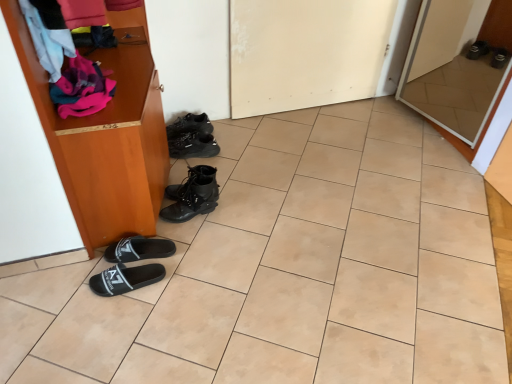
At what (x,y) coordinates should I click in order to perform the action: click on vacant area that lies between black fabric slipper at lower left, which ranks as the fourth footwear in back-to-front order, and black leather boots at center, which appears as the 3th footwear when viewed from the back. Please return your answer as a coordinate pair (x, y). The height and width of the screenshot is (384, 512). Looking at the image, I should click on (180, 233).